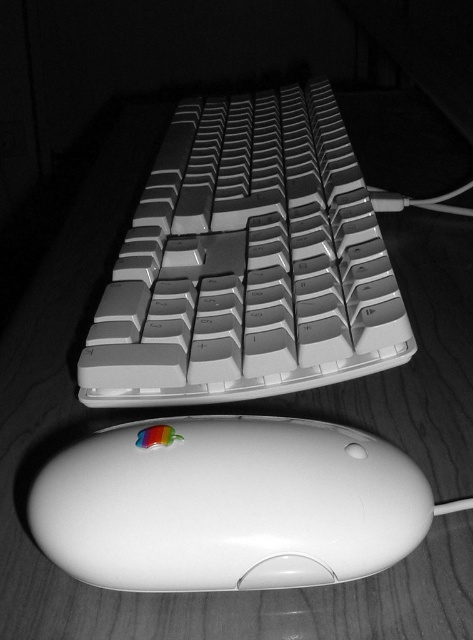
In the scene shown: Which of these two, white plastic keyboard at center or white glossy mouse at lower center, stands taller?

With more height is white plastic keyboard at center.

Is white plastic keyboard at center closer to camera compared to white glossy mouse at lower center?

No, white plastic keyboard at center is behind white glossy mouse at lower center.

Between point (251, 292) and point (131, 582), which one is positioned behind?

The point (251, 292) is more distant.

Locate an element on the screen. Image resolution: width=473 pixels, height=640 pixels. white plastic keyboard at center is located at coordinates (246, 262).